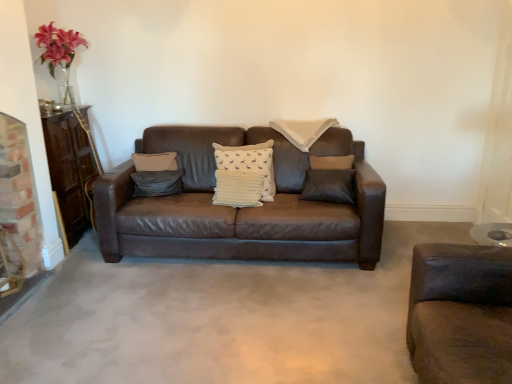
Question: Can you confirm if suede gray pillow at center, the 1th pillow positioned from the left, is bigger than white dotted fabric pillow at center, marked as the 1th pillow in a right-to-left arrangement?

Choices:
 (A) yes
 (B) no

Answer: (B)

Question: Is suede gray pillow at center, which is counted as the 2th pillow, starting from the right, closer to the viewer compared to white dotted fabric pillow at center, the 2th pillow when ordered from left to right?

Choices:
 (A) yes
 (B) no

Answer: (B)

Question: Is suede gray pillow at center, which is counted as the 2th pillow, starting from the right, aimed at white dotted fabric pillow at center, the 2th pillow when ordered from left to right?

Choices:
 (A) no
 (B) yes

Answer: (A)

Question: Is suede gray pillow at center, the 1th pillow positioned from the left, smaller than white dotted fabric pillow at center, the 2th pillow when ordered from left to right?

Choices:
 (A) yes
 (B) no

Answer: (A)

Question: Can you confirm if suede gray pillow at center, the 1th pillow positioned from the left, is thinner than white dotted fabric pillow at center, marked as the 1th pillow in a right-to-left arrangement?

Choices:
 (A) no
 (B) yes

Answer: (B)

Question: Is suede gray pillow at center, which is counted as the 2th pillow, starting from the right, turned away from white dotted fabric pillow at center, marked as the 1th pillow in a right-to-left arrangement?

Choices:
 (A) no
 (B) yes

Answer: (A)

Question: Can you confirm if white dotted fabric pillow at center, marked as the 1th pillow in a right-to-left arrangement, is wider than gray concrete at center?

Choices:
 (A) no
 (B) yes

Answer: (A)

Question: Is white dotted fabric pillow at center, marked as the 1th pillow in a right-to-left arrangement, placed right next to gray concrete at center?

Choices:
 (A) yes
 (B) no

Answer: (B)

Question: Is gray concrete at center completely or partially inside white dotted fabric pillow at center, the 2th pillow when ordered from left to right?

Choices:
 (A) yes
 (B) no

Answer: (B)

Question: Does white dotted fabric pillow at center, marked as the 1th pillow in a right-to-left arrangement, have a greater height compared to gray concrete at center?

Choices:
 (A) no
 (B) yes

Answer: (B)

Question: Does white dotted fabric pillow at center, the 2th pillow when ordered from left to right, have a lesser width compared to gray concrete at center?

Choices:
 (A) yes
 (B) no

Answer: (A)

Question: Is white dotted fabric pillow at center, marked as the 1th pillow in a right-to-left arrangement, looking in the opposite direction of gray concrete at center?

Choices:
 (A) no
 (B) yes

Answer: (A)

Question: Does suede gray pillow at center, the 1th pillow positioned from the left, have a larger size compared to gray concrete at center?

Choices:
 (A) yes
 (B) no

Answer: (B)